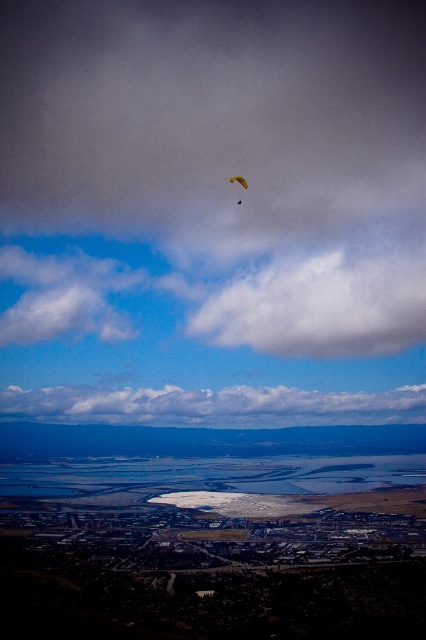
Can you confirm if white fluffy cloud at center is positioned above yellow fabric parasail at upper center?

No.

Locate an element on the screen. white fluffy cloud at center is located at coordinates (215, 404).

Find the location of a particular element. white fluffy cloud at center is located at coordinates (215, 404).

Which is behind, point (377, 304) or point (29, 390)?

The point (29, 390) is more distant.

Based on the photo, measure the distance from white fluffy cloud at upper center to white fluffy cloud at center.

white fluffy cloud at upper center and white fluffy cloud at center are 84.64 meters apart from each other.

Locate an element on the screen. The height and width of the screenshot is (640, 426). white fluffy cloud at upper center is located at coordinates (321, 307).

Between point (371, 321) and point (242, 177), which one is positioned behind?

The point (242, 177) is behind.

Who is more forward, (x=397, y=324) or (x=239, y=177)?

Point (x=239, y=177) is in front.

Where is `white fluffy cloud at upper center`? The width and height of the screenshot is (426, 640). white fluffy cloud at upper center is located at coordinates (321, 307).